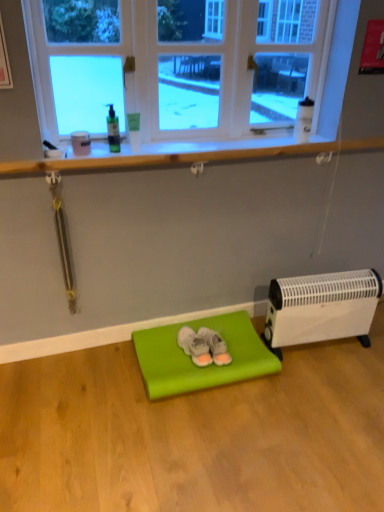
Identify the location of free location to the left of gray suede slippers at center, acting as the 2th footwear starting from the right. The width and height of the screenshot is (384, 512). (164, 349).